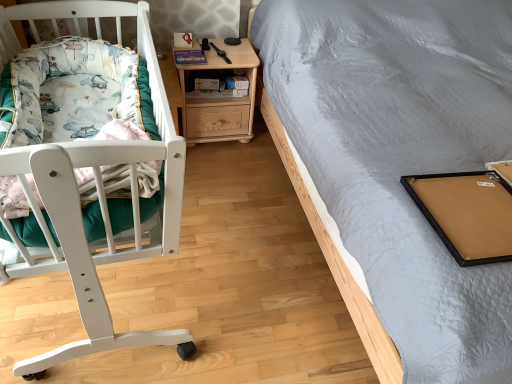
Find the location of a particular element. free location in front of light woodmaterial/texturenightstand at center is located at coordinates (222, 163).